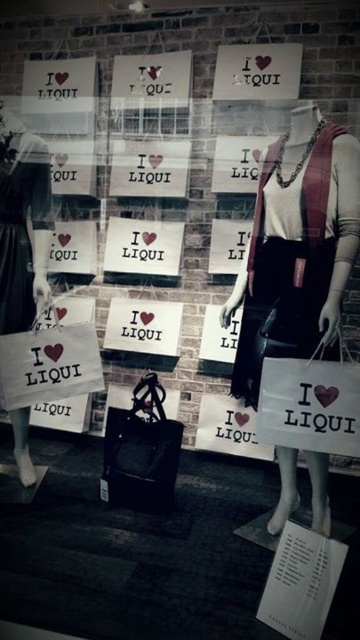
The image size is (360, 640). What do you see at coordinates (23, 224) in the screenshot?
I see `white paper bag at left` at bounding box center [23, 224].

Who is more forward, (6, 250) or (10, 236)?

Positioned in front is point (10, 236).

Measure the distance between point (16,196) and camera.

They are 6.54 feet apart.

Find the location of a particular element. white paper bag at left is located at coordinates (23, 224).

Can you confirm if matte black dress at center is shorter than black satin dress at left?

No, matte black dress at center is not shorter than black satin dress at left.

Can you confirm if matte black dress at center is positioned to the left of black satin dress at left?

Incorrect, matte black dress at center is not on the left side of black satin dress at left.

Locate an element on the screen. matte black dress at center is located at coordinates (297, 250).

Is matte black dress at center further to the viewer compared to white paper bag at left?

No, it is in front of white paper bag at left.

Is matte black dress at center to the right of white paper bag at left from the viewer's perspective?

Yes, matte black dress at center is to the right of white paper bag at left.

Find the location of `matte black dress at center`. matte black dress at center is located at coordinates (297, 250).